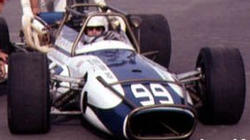
The height and width of the screenshot is (140, 250). I want to click on surface, so click(x=205, y=29).